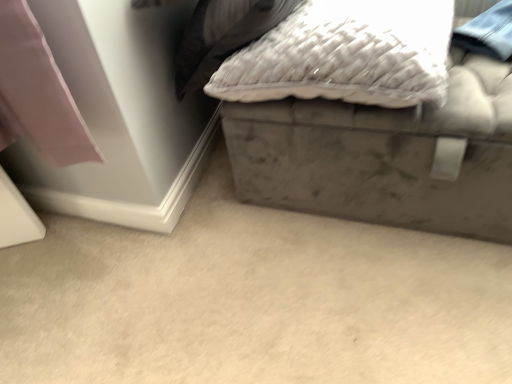
Question: From the image's perspective, is gray matte storage box at lower right positioned above or below velvet gray ottoman at upper right?

Choices:
 (A) below
 (B) above

Answer: (A)

Question: Is point (307, 218) positioned closer to the camera than point (349, 115)?

Choices:
 (A) farther
 (B) closer

Answer: (A)

Question: Which object is the farthest from the velvet gray ottoman at upper right?

Choices:
 (A) gray matte storage box at lower right
 (B) white textured pillow at upper center

Answer: (A)

Question: Which of these objects is positioned farthest from the gray matte storage box at lower right?

Choices:
 (A) velvet gray ottoman at upper right
 (B) white textured pillow at upper center

Answer: (B)